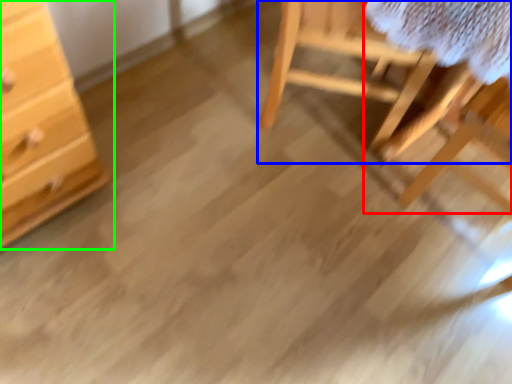
Question: Which object is the farthest from table (highlighted by a red box)? Choose among these: furniture (highlighted by a blue box) or chest of drawers (highlighted by a green box).

Choices:
 (A) furniture
 (B) chest of drawers

Answer: (B)